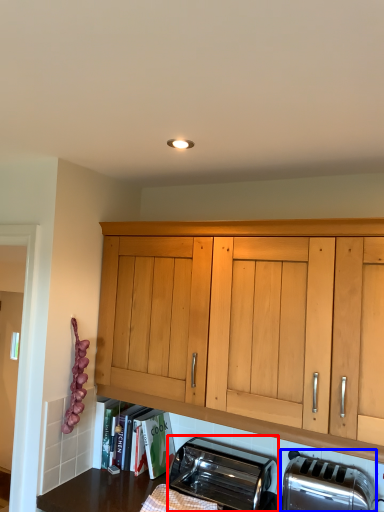
Question: Which object is further to the camera taking this photo, toaster (highlighted by a red box) or toaster (highlighted by a blue box)?

Choices:
 (A) toaster
 (B) toaster

Answer: (A)